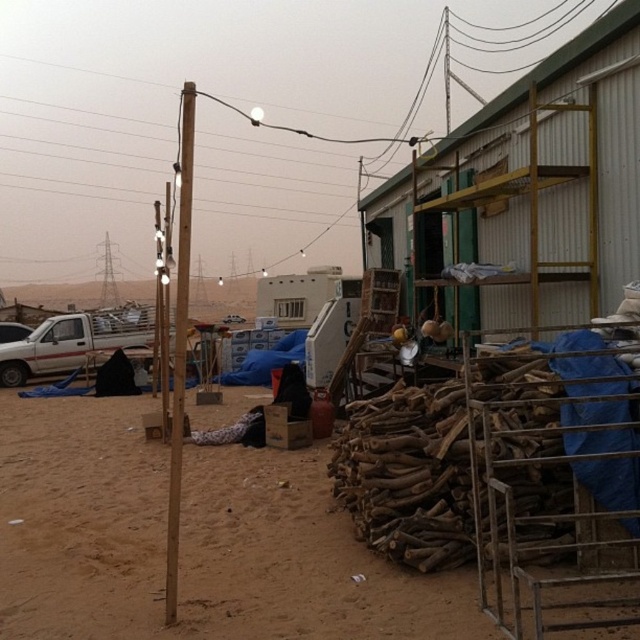
Does brown sandy dirt at lower left have a greater height compared to brown wooden pole at center?

No.

Who is positioned more to the right, brown sandy dirt at lower left or brown wooden pole at center?

brown sandy dirt at lower left is more to the right.

The width and height of the screenshot is (640, 640). What are the coordinates of `brown sandy dirt at lower left` in the screenshot? It's located at (192, 540).

Who is more forward, (58, 314) or (168, 534)?

Positioned in front is point (168, 534).

Describe the element at coordinates (72, 342) in the screenshot. The width and height of the screenshot is (640, 640). I see `white matte truck at left` at that location.

This screenshot has width=640, height=640. I want to click on white matte truck at left, so click(72, 342).

What do you see at coordinates (192, 540) in the screenshot? I see `brown sandy dirt at lower left` at bounding box center [192, 540].

Who is taller, brown sandy dirt at lower left or white matte truck at left?

white matte truck at left is taller.

Where is `brown sandy dirt at lower left`? brown sandy dirt at lower left is located at coordinates (192, 540).